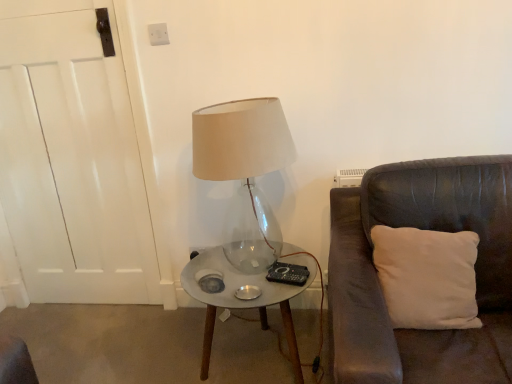
The height and width of the screenshot is (384, 512). Find the location of `free space below clear glass table at center (from a real-world perspective)`. free space below clear glass table at center (from a real-world perspective) is located at coordinates coord(255,364).